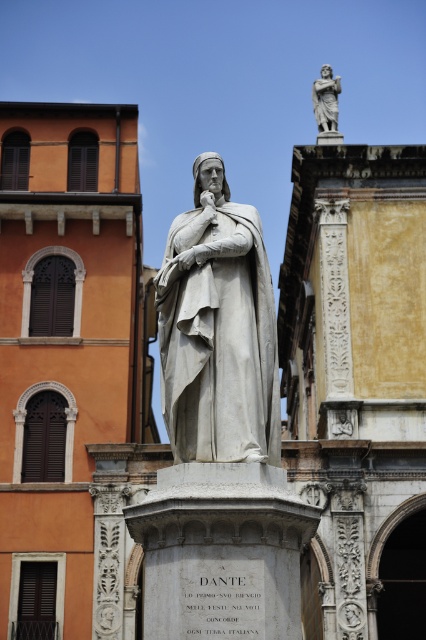
Can you confirm if white marble statue at center is smaller than polished marble statue at upper center?

Yes, white marble statue at center is smaller than polished marble statue at upper center.

Can you confirm if white marble statue at center is shorter than polished marble statue at upper center?

Yes.

This screenshot has width=426, height=640. Describe the element at coordinates (218, 330) in the screenshot. I see `white marble statue at center` at that location.

Image resolution: width=426 pixels, height=640 pixels. Identify the location of white marble statue at center. (218, 330).